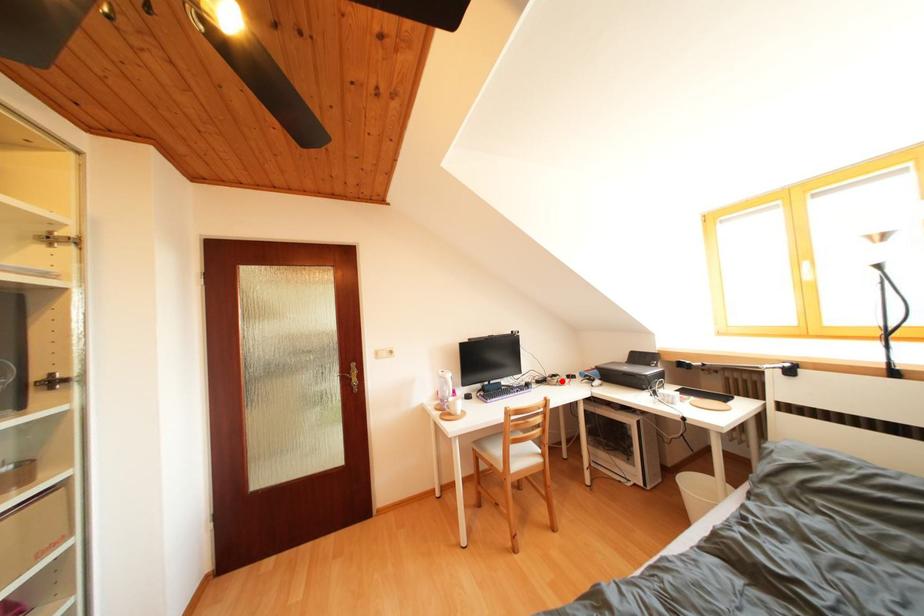
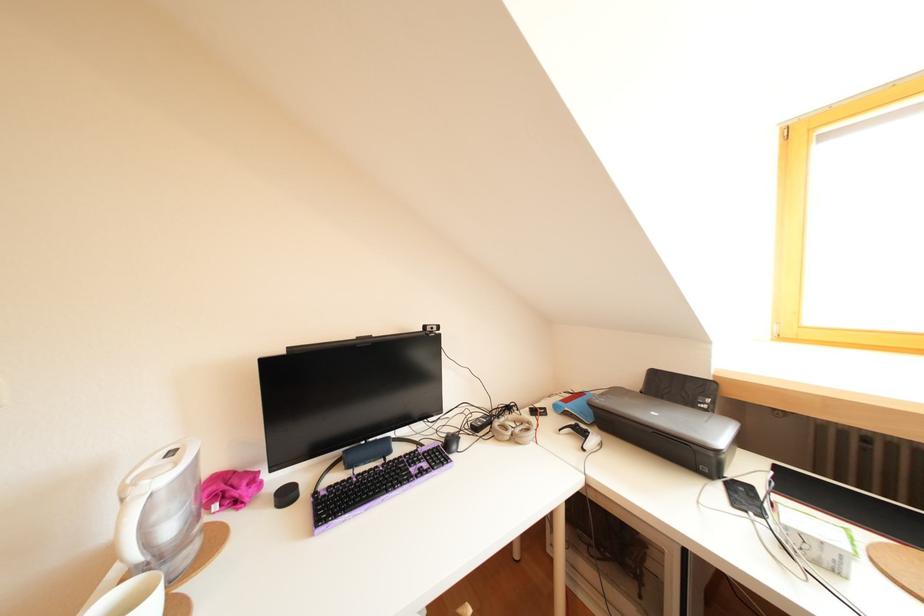
Locate, in the second image, the point that corresponds to the highlighted location in the first image.

(516, 413)